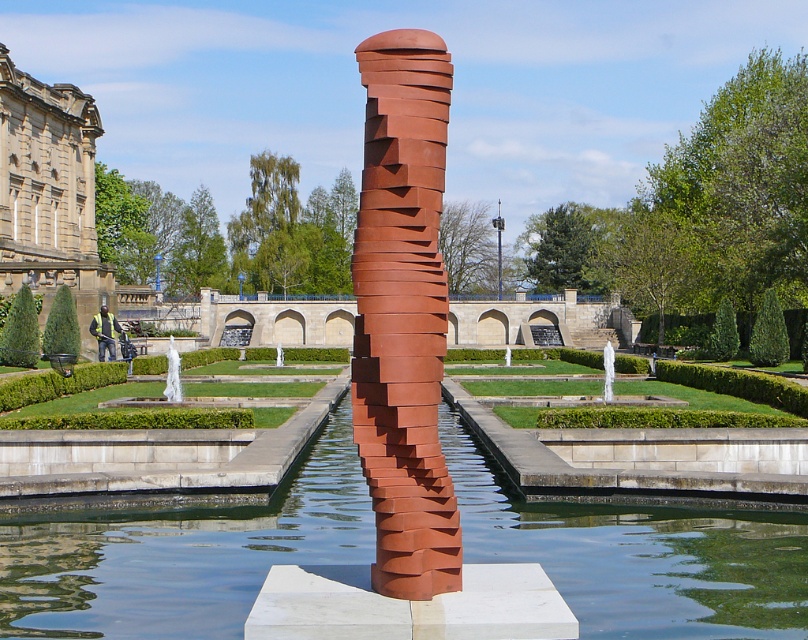
Consider the image. You are a landscape architect designing a new garden. You want to place a new statue that is 2 meters tall between the clear water at center and the white marble fountain at center. Which object should the statue be placed closer to so it doesn

The clear water at center is not as tall as the white marble fountain at center, so the statue should be placed closer to the white marble fountain at center to maintain visual balance with the taller object.